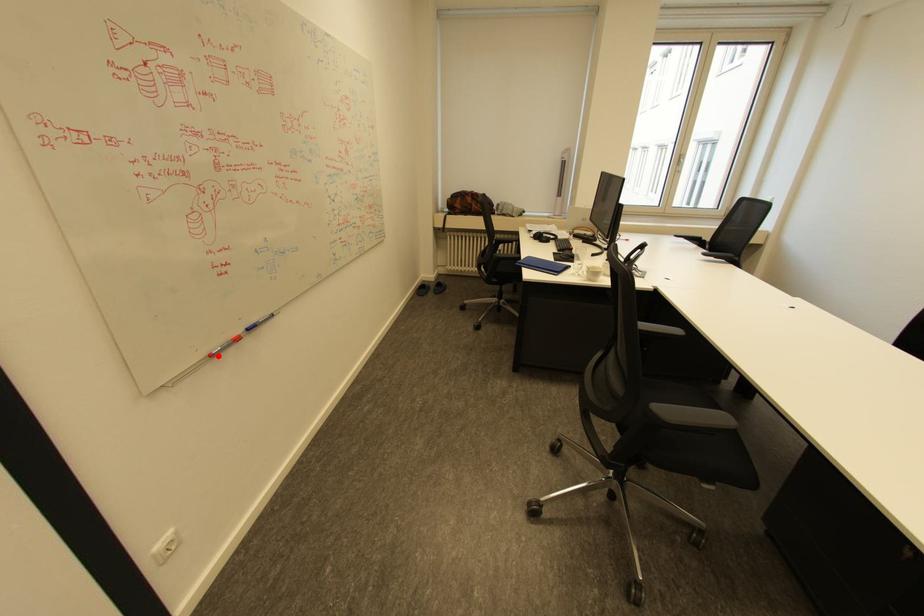
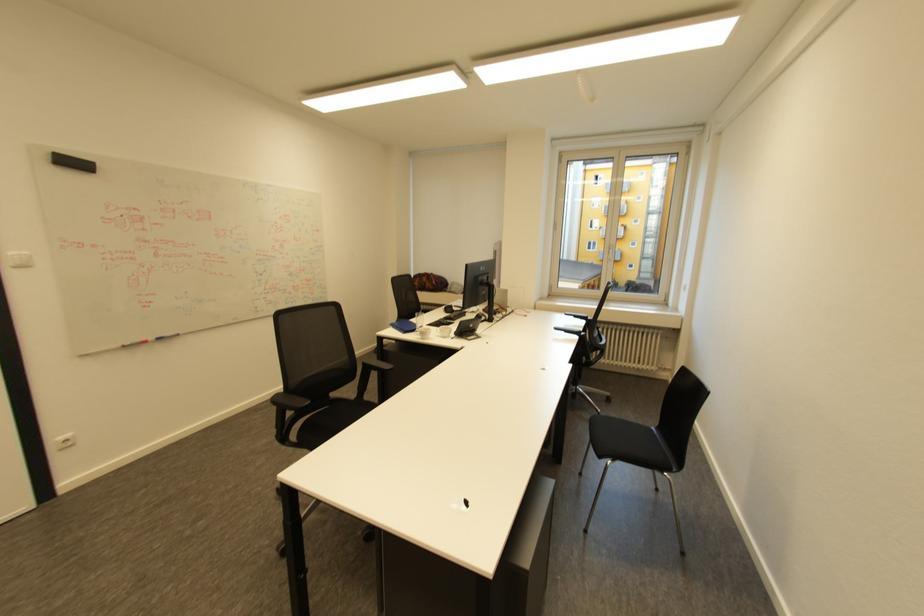
Question: I am providing you with two images of the same scene from different viewpoints. A red point is marked on the first image. Is the red point's position out of view in image 2?

Choices:
 (A) Yes
 (B) No

Answer: (B)